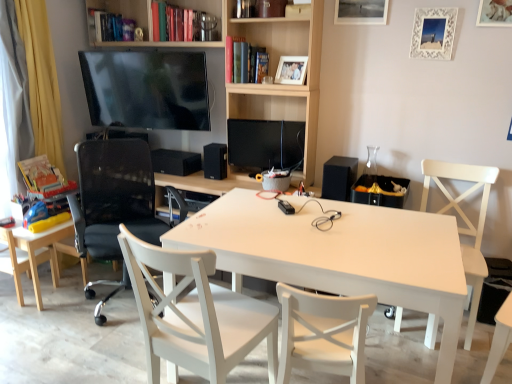
Question: Is hardcover book at upper left, which is counted as the third book, starting from the bottom, outside white wood chair at right, which is the 4th chair from left to right?

Choices:
 (A) no
 (B) yes

Answer: (B)

Question: Can you confirm if hardcover book at upper left, positioned as the second book in left-to-right order, is positioned to the right of white wood chair at right, which is the 4th chair from left to right?

Choices:
 (A) yes
 (B) no

Answer: (B)

Question: Would you say hardcover book at upper left, the second book in the right-to-left sequence, contains white wood chair at right, which ranks as the 1th chair in right-to-left order?

Choices:
 (A) no
 (B) yes

Answer: (A)

Question: Is hardcover book at upper left, which is counted as the third book, starting from the bottom, facing towards white wood chair at right, which is the 4th chair from left to right?

Choices:
 (A) yes
 (B) no

Answer: (B)

Question: From the image's perspective, is hardcover book at upper left, the second book in the right-to-left sequence, over white wood chair at right, which is the 4th chair from left to right?

Choices:
 (A) yes
 (B) no

Answer: (A)

Question: Visually, is metallic silver picture frame at upper center, which appears as the third picture frame when viewed from the right, positioned to the left or to the right of white matte table at center?

Choices:
 (A) left
 (B) right

Answer: (B)

Question: From the image's perspective, is metallic silver picture frame at upper center, positioned as the 2th picture frame in left-to-right order, positioned above or below white matte table at center?

Choices:
 (A) below
 (B) above

Answer: (B)

Question: Is metallic silver picture frame at upper center, positioned as the 2th picture frame in left-to-right order, in front of or behind white matte table at center in the image?

Choices:
 (A) behind
 (B) front

Answer: (A)

Question: Is metallic silver picture frame at upper center, positioned as the 2th picture frame in left-to-right order, inside the boundaries of white matte table at center, or outside?

Choices:
 (A) outside
 (B) inside

Answer: (A)

Question: Considering the positions of hardcover book at upper left, the second book in the right-to-left sequence, and black mesh office chair at left, which is the 2th chair in left-to-right order, in the image, is hardcover book at upper left, the second book in the right-to-left sequence, taller or shorter than black mesh office chair at left, which is the 2th chair in left-to-right order,?

Choices:
 (A) tall
 (B) short

Answer: (B)

Question: In the image, is hardcover book at upper left, which is counted as the third book, starting from the bottom, on the left side or the right side of black mesh office chair at left, placed as the third chair when sorted from right to left?

Choices:
 (A) left
 (B) right

Answer: (A)

Question: Looking at their shapes, would you say hardcover book at upper left, positioned as the second book in left-to-right order, is wider or thinner than black mesh office chair at left, placed as the third chair when sorted from right to left?

Choices:
 (A) wide
 (B) thin

Answer: (B)

Question: From the image's perspective, is hardcover book at upper left, arranged as the first book when viewed from the top, above or below black mesh office chair at left, which is the 2th chair in left-to-right order?

Choices:
 (A) below
 (B) above

Answer: (B)

Question: Considering the positions of wooden photo frame at upper center, marked as the first picture frame in a left-to-right arrangement, and white wood chair at center, the third chair from the left, in the image, is wooden photo frame at upper center, marked as the first picture frame in a left-to-right arrangement, wider or thinner than white wood chair at center, the third chair from the left,?

Choices:
 (A) wide
 (B) thin

Answer: (B)

Question: Considering the positions of wooden photo frame at upper center, the 4th picture frame viewed from the right, and white wood chair at center, the 2th chair when ordered from right to left, in the image, is wooden photo frame at upper center, the 4th picture frame viewed from the right, taller or shorter than white wood chair at center, the 2th chair when ordered from right to left,?

Choices:
 (A) tall
 (B) short

Answer: (B)